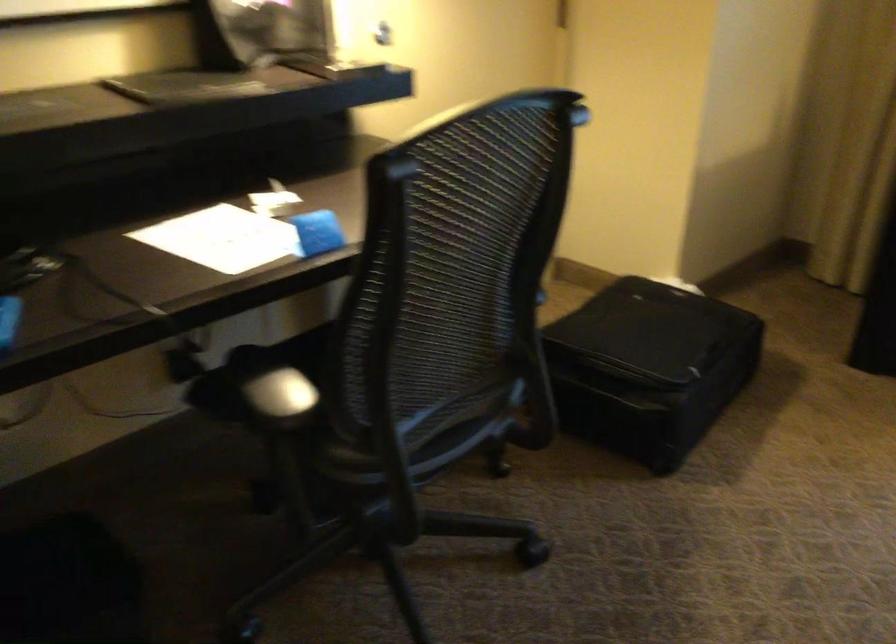
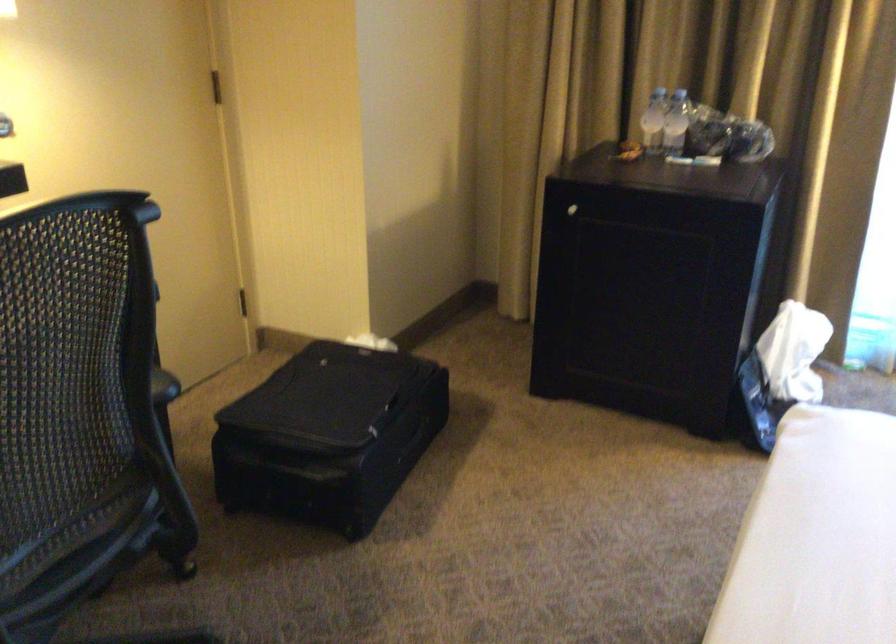
In the second image, find the point that corresponds to the point at 650,366 in the first image.

(329, 436)